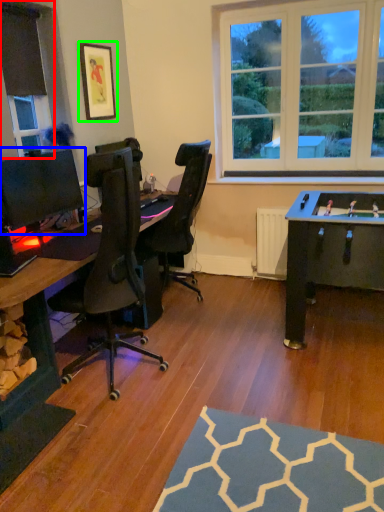
Question: Which object is positioned farthest from window frame (highlighted by a red box)? Select from computer monitor (highlighted by a blue box) and picture frame (highlighted by a green box).

Choices:
 (A) computer monitor
 (B) picture frame

Answer: (A)